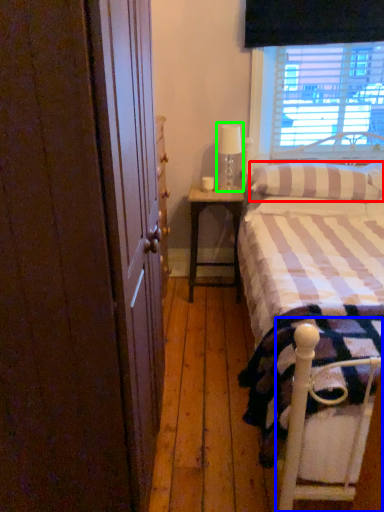
Question: Based on their relative distances, which object is nearer to pillow (highlighted by a red box)? Choose from bed frame (highlighted by a blue box) and table lamp (highlighted by a green box).

Choices:
 (A) bed frame
 (B) table lamp

Answer: (B)